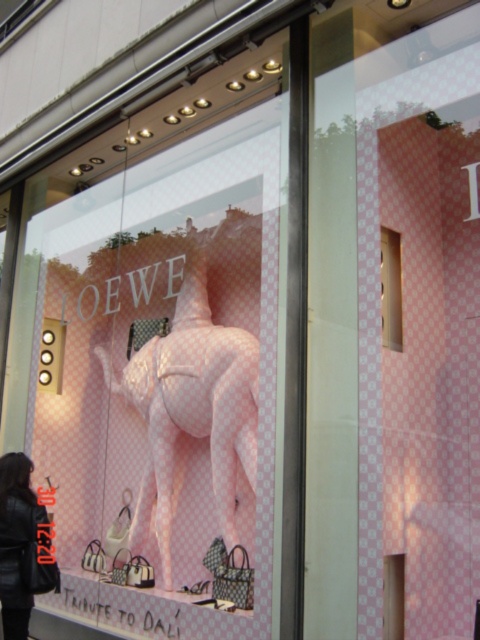
Based on the photo, who is higher up, pink checkered mannequin at center or pink glossy box at upper right?

pink glossy box at upper right is higher up.

Between point (158, 458) and point (399, 308), which one is positioned behind?

The point (158, 458) is behind.

At what (x,y) coordinates should I click in order to perform the action: click on pink checkered mannequin at center. Please return your answer as a coordinate pair (x, y). The image size is (480, 640). Looking at the image, I should click on (192, 410).

I want to click on pink checkered mannequin at center, so click(x=192, y=410).

Can you confirm if black leather jacket at lower left is positioned to the left of pink glossy box at upper right?

Correct, you'll find black leather jacket at lower left to the left of pink glossy box at upper right.

Who is positioned more to the right, black leather jacket at lower left or pink glossy box at upper right?

pink glossy box at upper right

Is point (19, 508) farther from camera compared to point (389, 253)?

Yes, point (19, 508) is behind point (389, 253).

You are a GUI agent. You are given a task and a screenshot of the screen. Output one action in this format:
    pyautogui.click(x=<x>, y=<y>)
    Task: Click on the black leather jacket at lower left
    
    Given the screenshot: What is the action you would take?
    pyautogui.click(x=20, y=545)

Between pink checkered mannequin at center and black leather jacket at lower left, which one is positioned lower?

black leather jacket at lower left

Which is in front, point (159, 337) or point (4, 636)?

Point (4, 636) is more forward.

Is point (190, 380) more distant than point (36, 518)?

Yes, point (190, 380) is behind point (36, 518).

Image resolution: width=480 pixels, height=640 pixels. Identify the location of pink checkered mannequin at center. (192, 410).